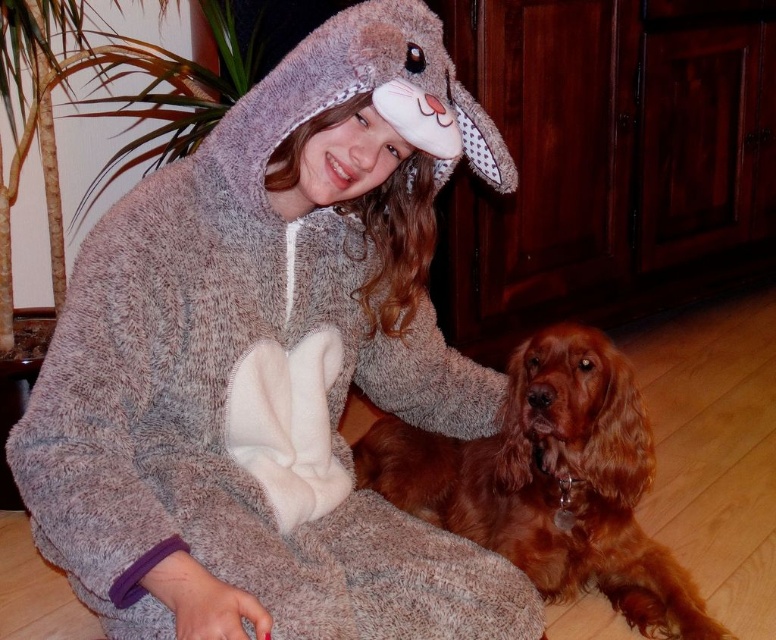
Is fluffy gray onesie at center wider than brown furry dog at lower right?

Yes, fluffy gray onesie at center is wider than brown furry dog at lower right.

Is fluffy gray onesie at center to the right of brown furry dog at lower right from the viewer's perspective?

No, fluffy gray onesie at center is not to the right of brown furry dog at lower right.

This screenshot has height=640, width=776. Describe the element at coordinates (272, 364) in the screenshot. I see `fluffy gray onesie at center` at that location.

At what (x,y) coordinates should I click in order to perform the action: click on fluffy gray onesie at center. Please return your answer as a coordinate pair (x, y). Looking at the image, I should click on click(x=272, y=364).